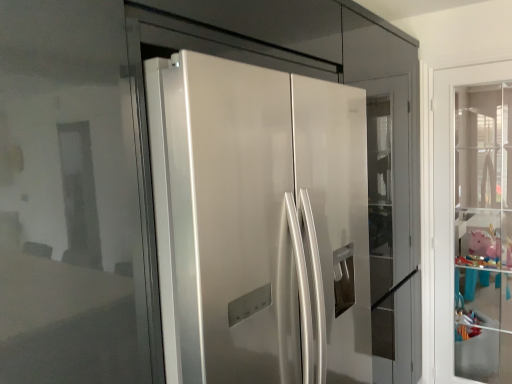
Question: Can you confirm if glossy white refrigerator at center, which appears as the 2th door when viewed from the right, is positioned to the right of pink matte piggy bank at right?

Choices:
 (A) yes
 (B) no

Answer: (B)

Question: Considering the relative positions of glossy white refrigerator at center, which is counted as the 1th door, starting from the left, and pink matte piggy bank at right in the image provided, is glossy white refrigerator at center, which is counted as the 1th door, starting from the left, to the left of pink matte piggy bank at right from the viewer's perspective?

Choices:
 (A) yes
 (B) no

Answer: (A)

Question: Are glossy white refrigerator at center, which ranks as the 1th door in front-to-back order, and pink matte piggy bank at right making contact?

Choices:
 (A) no
 (B) yes

Answer: (A)

Question: Could you tell me if glossy white refrigerator at center, which ranks as the 1th door in front-to-back order, is turned towards pink matte piggy bank at right?

Choices:
 (A) yes
 (B) no

Answer: (B)

Question: Considering the relative sizes of glossy white refrigerator at center, which is counted as the 1th door, starting from the left, and pink matte piggy bank at right in the image provided, is glossy white refrigerator at center, which is counted as the 1th door, starting from the left, smaller than pink matte piggy bank at right?

Choices:
 (A) yes
 (B) no

Answer: (B)

Question: From a real-world perspective, relative to glossy white refrigerator at center, which is counted as the 1th door, starting from the left, is clear glass door at right, the 1th door from the right, vertically above or below?

Choices:
 (A) below
 (B) above

Answer: (A)

Question: From the image's perspective, relative to glossy white refrigerator at center, which appears as the 2th door when viewed from the right, is clear glass door at right, the 2th door in the front-to-back sequence, above or below?

Choices:
 (A) above
 (B) below

Answer: (A)

Question: Is clear glass door at right, which is counted as the first door, starting from the back, wider or thinner than glossy white refrigerator at center, which appears as the 2th door when viewed from the right?

Choices:
 (A) wide
 (B) thin

Answer: (B)

Question: Do you think clear glass door at right, the 1th door from the right, is within glossy white refrigerator at center, which appears as the 2th door when viewed from the right, or outside of it?

Choices:
 (A) inside
 (B) outside

Answer: (B)

Question: Considering their positions, is glossy white refrigerator at center, which is counted as the 1th door, starting from the left, located in front of or behind clear glass door at right, the 1th door from the right?

Choices:
 (A) behind
 (B) front

Answer: (B)

Question: From a real-world perspective, is glossy white refrigerator at center, which ranks as the 1th door in front-to-back order, positioned above or below clear glass door at right, the 2th door in the front-to-back sequence?

Choices:
 (A) above
 (B) below

Answer: (A)

Question: Is point (281, 249) positioned closer to the camera than point (437, 92)?

Choices:
 (A) closer
 (B) farther

Answer: (A)

Question: Looking at their shapes, would you say glossy white refrigerator at center, which appears as the 2th door when viewed from the right, is wider or thinner than clear glass door at right, the 2th door in the front-to-back sequence?

Choices:
 (A) thin
 (B) wide

Answer: (B)

Question: Considering the relative positions of pink matte piggy bank at right and glossy white refrigerator at center, which ranks as the 1th door in front-to-back order, in the image provided, is pink matte piggy bank at right to the left or to the right of glossy white refrigerator at center, which ranks as the 1th door in front-to-back order,?

Choices:
 (A) left
 (B) right

Answer: (B)

Question: Is pink matte piggy bank at right situated inside glossy white refrigerator at center, the 2th door viewed from the back, or outside?

Choices:
 (A) inside
 (B) outside

Answer: (B)